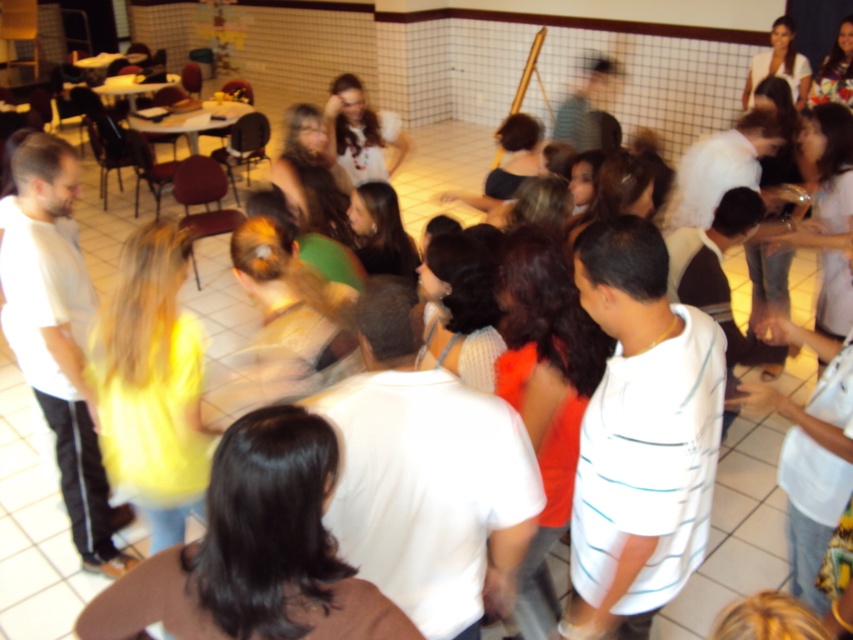
In the scene shown: You are a photographer at the event and want to capture a clear photo of the white striped shirt at center and the brown hair at center. Which object should you focus on to ensure it appears larger in the photo?

The white striped shirt at center is larger in size than the brown hair at center, so focusing on the white striped shirt at center will make it appear larger in the photo.

You are at the entrance of the room and want to find the white striped shirt at center. Based on the coordinates provided, in which direction should you look to spot it?

The white striped shirt at center is located at coordinates point (640, 436), which means you should look towards the lower middle area of the room to find it.

You are a photographer at the event and want to capture a photo of the brown hair at center without including the white striped shirt at center in the frame. Is it possible to do so by moving your position?

The brown hair at center is behind the white striped shirt at center, so moving your position might allow you to angle the camera around the white striped shirt at center to capture the brown hair at center without including it in the frame.